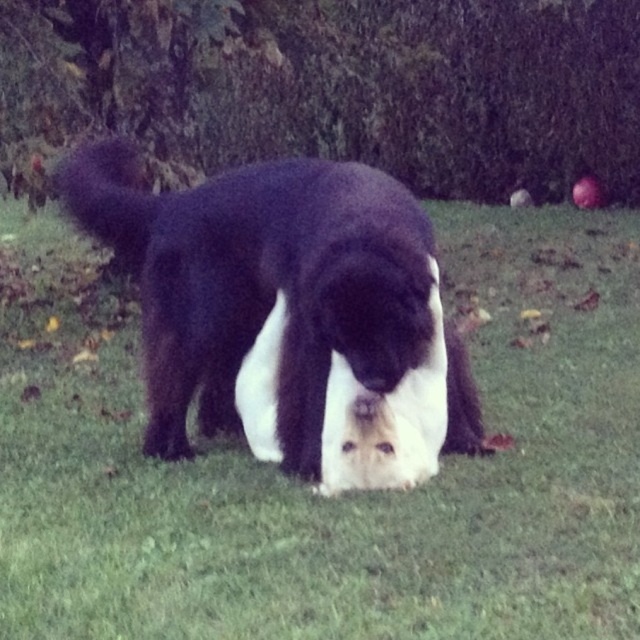
You are a photographer trying to capture the black fur dog at center in your shot. The green grass at center is blocking your view. Can you move the grass to get a clear shot of the dog?

The black fur dog at center is behind the green grass at center, so you cannot move the grass as it is part of the scene. Adjust your position to capture the dog without obstruction.